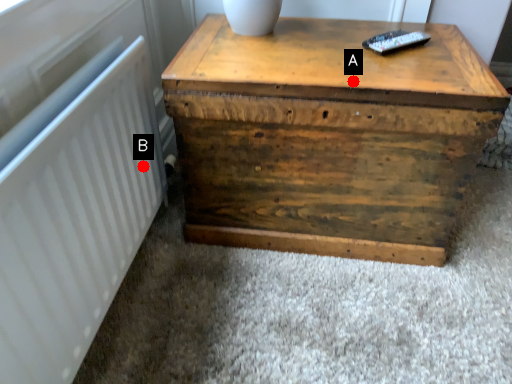
Question: Two points are circled on the image, labeled by A and B beside each circle. Which point is closer to the camera?

Choices:
 (A) A is closer
 (B) B is closer

Answer: (A)